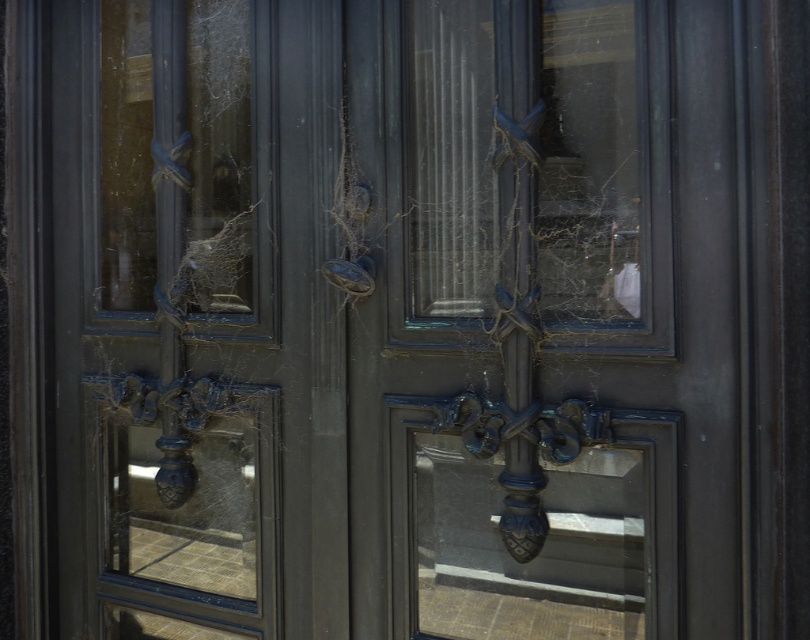
You are trying to enter a house and see the matte dark blue screen door at center and the matte dark blue door at center. Which one should you open to enter?

The matte dark blue door at center is the actual door, so you should open the matte dark blue door at center to enter.

You are trying to determine if the matte dark blue screen door at center can fit through the doorway of the matte dark blue door at center. Based on their thickness, will it fit?

The matte dark blue screen door at center is thinner than the matte dark blue door at center, so it can fit through the doorway.